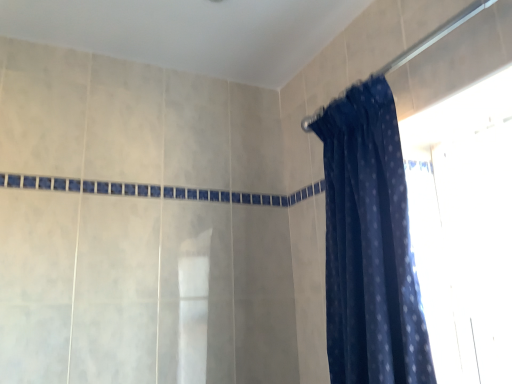
Question: From the image's perspective, does dark blue fabric at upper right appear lower than dark blue sheer at upper right?

Choices:
 (A) no
 (B) yes

Answer: (A)

Question: Is dark blue fabric at upper right oriented towards dark blue sheer at upper right?

Choices:
 (A) no
 (B) yes

Answer: (A)

Question: From a real-world perspective, is dark blue fabric at upper right physically below dark blue sheer at upper right?

Choices:
 (A) yes
 (B) no

Answer: (B)

Question: Considering the relative sizes of dark blue fabric at upper right and dark blue sheer at upper right in the image provided, is dark blue fabric at upper right bigger than dark blue sheer at upper right?

Choices:
 (A) no
 (B) yes

Answer: (A)

Question: From a real-world perspective, is dark blue fabric at upper right located higher than dark blue sheer at upper right?

Choices:
 (A) no
 (B) yes

Answer: (B)

Question: Considering the relative positions of dark blue fabric at upper right and dark blue sheer at upper right in the image provided, is dark blue fabric at upper right to the right of dark blue sheer at upper right from the viewer's perspective?

Choices:
 (A) no
 (B) yes

Answer: (B)

Question: Would you say dark blue sheer at upper right is a long distance from dark blue fabric at upper right?

Choices:
 (A) no
 (B) yes

Answer: (A)

Question: Is dark blue sheer at upper right turned away from dark blue fabric at upper right?

Choices:
 (A) no
 (B) yes

Answer: (A)

Question: From a real-world perspective, is dark blue sheer at upper right over dark blue fabric at upper right?

Choices:
 (A) yes
 (B) no

Answer: (B)

Question: Does dark blue sheer at upper right turn towards dark blue fabric at upper right?

Choices:
 (A) no
 (B) yes

Answer: (A)

Question: Is dark blue sheer at upper right taller than dark blue fabric at upper right?

Choices:
 (A) no
 (B) yes

Answer: (B)

Question: From the image's perspective, is dark blue sheer at upper right below dark blue fabric at upper right?

Choices:
 (A) yes
 (B) no

Answer: (A)

Question: Considering the positions of point (407, 54) and point (373, 347), is point (407, 54) closer or farther from the camera than point (373, 347)?

Choices:
 (A) farther
 (B) closer

Answer: (A)